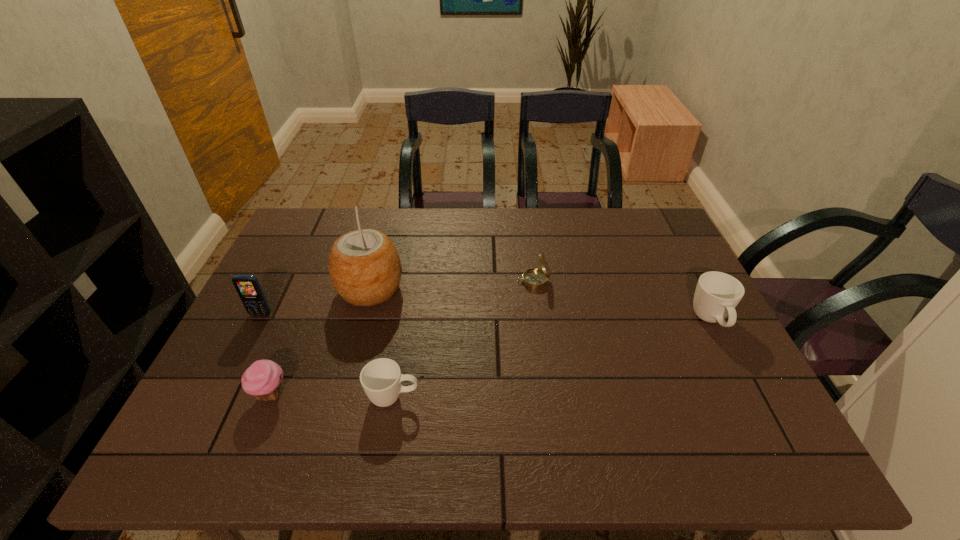
This screenshot has height=540, width=960. I want to click on cupcake positioned at the left edge, so click(x=262, y=379).

You are a GUI agent. You are given a task and a screenshot of the screen. Output one action in this format:
    pyautogui.click(x=<x>, y=<y>)
    Task: Click on the object positioned at the right edge
    Image resolution: width=960 pixels, height=540 pixels.
    Given the screenshot: What is the action you would take?
    pyautogui.click(x=717, y=294)

I want to click on object at the near left corner, so click(262, 379).

Identify the location of vacant area at the far edge. The width and height of the screenshot is (960, 540). click(521, 214).

In the image, there is a desktop. Where is `vacant area at the near edge`? vacant area at the near edge is located at coordinates (485, 409).

Where is `free space at the left edge`? The height and width of the screenshot is (540, 960). free space at the left edge is located at coordinates (308, 262).

Locate an element on the screen. This screenshot has width=960, height=540. vacant space at the right edge of the desktop is located at coordinates (751, 378).

Where is `blank space at the far left corner of the desktop`? This screenshot has height=540, width=960. blank space at the far left corner of the desktop is located at coordinates (302, 227).

This screenshot has width=960, height=540. In order to click on vacant space that is in between the nearer cup and the cupcake in this screenshot , I will do `click(332, 395)`.

This screenshot has width=960, height=540. In order to click on free area in between the fifth shortest object and the tallest object in this screenshot , I will do `click(316, 302)`.